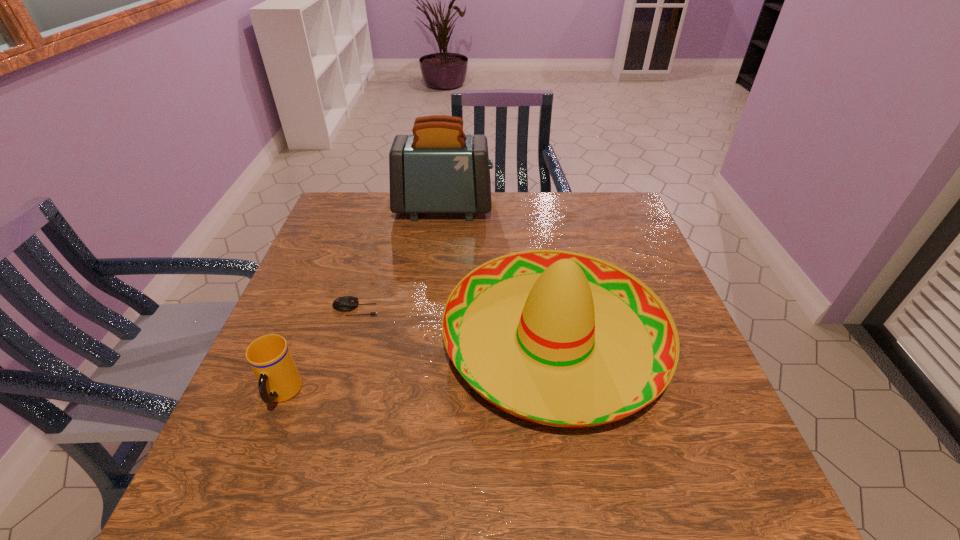
Find the location of a particular element. This screenshot has height=540, width=960. free space between the cup and the mouse is located at coordinates (319, 352).

What are the coordinates of `empty location between the leftmost object and the mouse` in the screenshot? It's located at (319, 352).

Locate an element on the screen. The width and height of the screenshot is (960, 540). free space that is in between the leftmost object and the toaster is located at coordinates (363, 301).

I want to click on vacant space that is in between the second shortest object and the tallest object, so click(363, 301).

Identify which object is located as the nearest to the toaster. Please provide its 2D coordinates. Your answer should be formatted as a tuple, i.e. [(x, y)], where the tuple contains the x and y coordinates of a point satisfying the conditions above.

[(559, 338)]

Image resolution: width=960 pixels, height=540 pixels. Identify the location of object that stands as the second closest to the sombrero. (438, 169).

Where is `free space that satisfies the following two spatial constraints: 1. on the front-facing side of the tallest object; 2. on the right side of the third shortest object`? Image resolution: width=960 pixels, height=540 pixels. free space that satisfies the following two spatial constraints: 1. on the front-facing side of the tallest object; 2. on the right side of the third shortest object is located at coordinates (429, 340).

Identify the location of vacant space that satisfies the following two spatial constraints: 1. on the front-facing side of the tallest object; 2. on the back side of the third shortest object. The width and height of the screenshot is (960, 540). [x=429, y=340].

Where is `free location that satisfies the following two spatial constraints: 1. on the front-facing side of the sombrero; 2. on the right side of the tallest object`? Image resolution: width=960 pixels, height=540 pixels. free location that satisfies the following two spatial constraints: 1. on the front-facing side of the sombrero; 2. on the right side of the tallest object is located at coordinates click(429, 340).

The image size is (960, 540). I want to click on vacant space that satisfies the following two spatial constraints: 1. on the front-facing side of the farthest object; 2. on the side of the third tallest object with the handle, so click(422, 394).